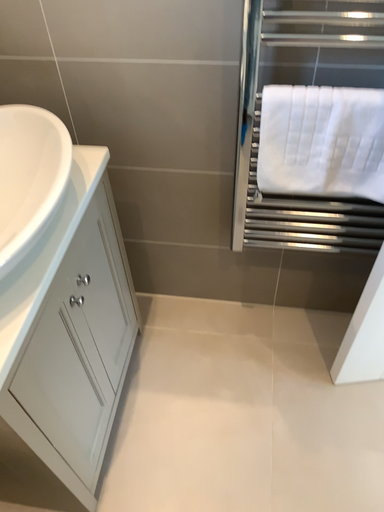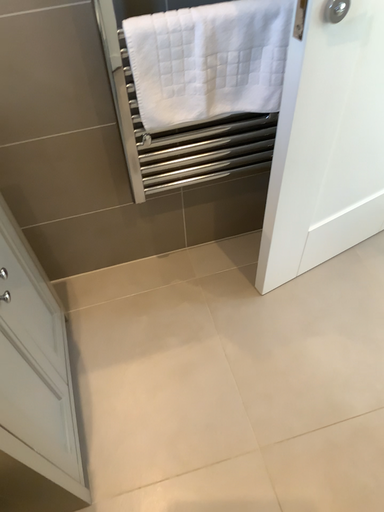
Question: How did the camera likely rotate when shooting the video?

Choices:
 (A) rotated right
 (B) rotated left

Answer: (A)